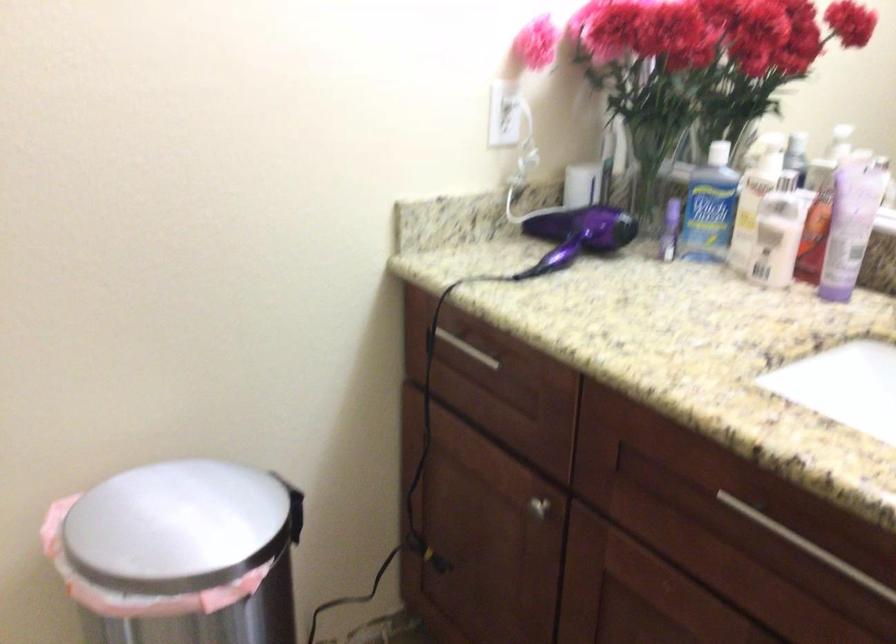
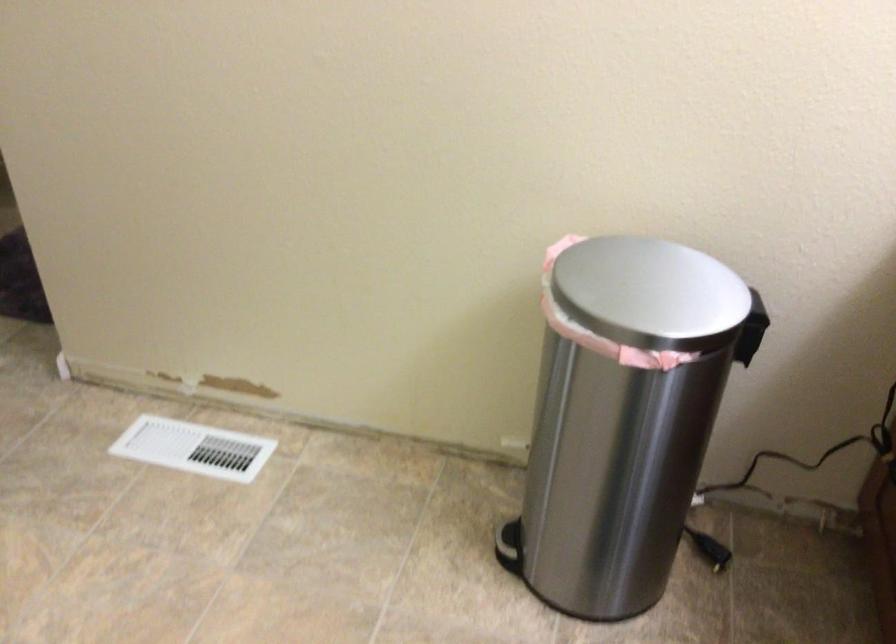
Where in the second image is the point corresponding to point (202, 509) from the first image?

(658, 288)